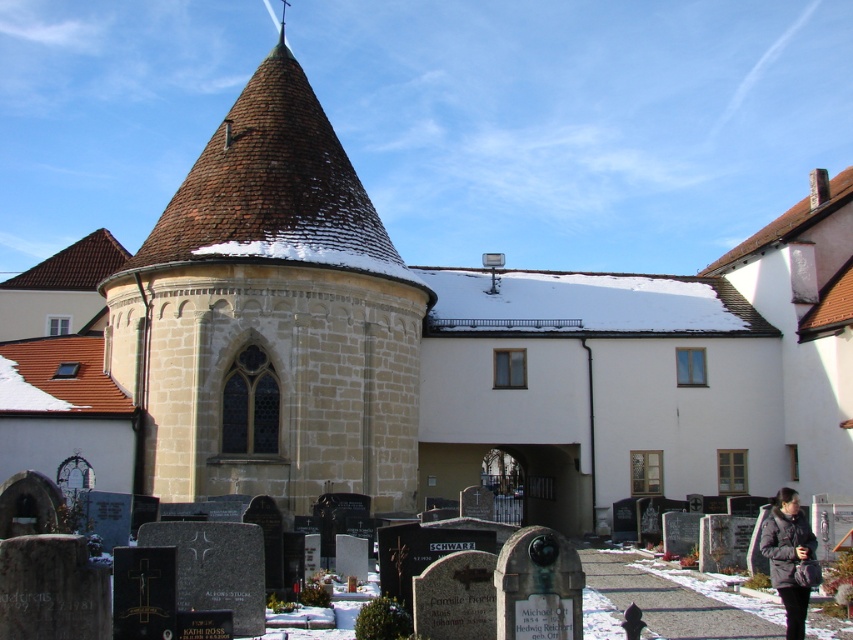
You are standing at the base of the historic round tower and want to walk to the point marked by point (296, 438). However, there is an obstacle at point (805, 548). Will you be able to see the obstacle from your current position?

Since point (296, 438) is behind point (805, 548), the obstacle at point (805, 548) will block your view of the target point. Therefore, you will not be able to see the obstacle from your current position.